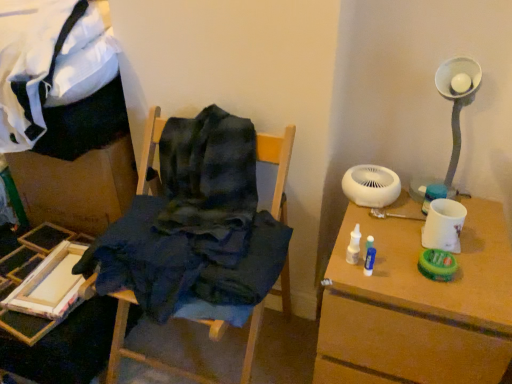
What do you see at coordinates (44, 291) in the screenshot?
I see `wooden paint tray at lower left, which ranks as the 2th furniture in right-to-left order` at bounding box center [44, 291].

Describe the element at coordinates (418, 306) in the screenshot. This screenshot has height=384, width=512. I see `white matte table at right` at that location.

The width and height of the screenshot is (512, 384). Describe the element at coordinates (134, 351) in the screenshot. I see `dark blue fabric at center, which is counted as the 2th furniture, starting from the left` at that location.

You are a GUI agent. You are given a task and a screenshot of the screen. Output one action in this format:
    pyautogui.click(x=<x>, y=<y>)
    Task: Click on the white matte mechanical fan at upper right
    The width and height of the screenshot is (512, 384).
    Given the screenshot: What is the action you would take?
    pyautogui.click(x=371, y=186)

Could you tell me if white matte mechanical fan at upper right is facing dark blue fabric at center, which is counted as the 2th furniture, starting from the left?

No, white matte mechanical fan at upper right is not aimed at dark blue fabric at center, which is counted as the 2th furniture, starting from the left.

Does point (373, 199) lie behind point (281, 147)?

Yes, point (373, 199) is farther from viewer.

Does white matte mechanical fan at upper right have a greater height compared to dark blue fabric at center, the 1th furniture when ordered from right to left?

No.

Is white matte table at right not within wooden paint tray at lower left, which ranks as the 2th furniture in right-to-left order?

Yes, white matte table at right is not within wooden paint tray at lower left, which ranks as the 2th furniture in right-to-left order.

From the image's perspective, is white matte table at right below wooden paint tray at lower left, which ranks as the 2th furniture in right-to-left order?

Yes, from the image's perspective, white matte table at right is below wooden paint tray at lower left, which ranks as the 2th furniture in right-to-left order.

Looking at their sizes, would you say white matte table at right is wider or thinner than wooden paint tray at lower left, the first furniture in the left-to-right sequence?

Clearly, white matte table at right has more width compared to wooden paint tray at lower left, the first furniture in the left-to-right sequence.

Is point (469, 369) closer to viewer compared to point (63, 315)?

Yes, it is.

Is dark blue fabric at center, which is counted as the 2th furniture, starting from the left, situated inside white matte mechanical fan at upper right or outside?

dark blue fabric at center, which is counted as the 2th furniture, starting from the left, lies outside white matte mechanical fan at upper right.

What's the angular difference between dark blue fabric at center, the 1th furniture when ordered from right to left, and white matte mechanical fan at upper right's facing directions?

They differ by 0.735 degrees in their facing directions.

Could you tell me if dark blue fabric at center, which is counted as the 2th furniture, starting from the left, is facing white matte mechanical fan at upper right?

No, dark blue fabric at center, which is counted as the 2th furniture, starting from the left, is not facing towards white matte mechanical fan at upper right.

Measure the distance between white matte mechanical fan at upper right and white matte table at right.

white matte mechanical fan at upper right and white matte table at right are 27.84 centimeters apart from each other.

Can you tell me how much white matte mechanical fan at upper right and white matte table at right differ in facing direction?

They differ by 1.29 degrees in their facing directions.

Is white matte mechanical fan at upper right looking in the opposite direction of white matte table at right?

No.

Can we say white matte mechanical fan at upper right lies outside white matte table at right?

Yes, white matte mechanical fan at upper right is located beyond the bounds of white matte table at right.

I want to click on furniture that appears behind the dark blue fabric at center, which is counted as the 2th furniture, starting from the left, so click(x=44, y=291).

Measure the distance from dark blue fabric at center, which is counted as the 2th furniture, starting from the left, to wooden paint tray at lower left, which ranks as the 2th furniture in right-to-left order.

dark blue fabric at center, which is counted as the 2th furniture, starting from the left, and wooden paint tray at lower left, which ranks as the 2th furniture in right-to-left order, are 12.56 inches apart from each other.

Considering the sizes of objects dark blue fabric at center, which is counted as the 2th furniture, starting from the left, and wooden paint tray at lower left, the first furniture in the left-to-right sequence, in the image provided, who is thinner, dark blue fabric at center, which is counted as the 2th furniture, starting from the left, or wooden paint tray at lower left, the first furniture in the left-to-right sequence,?

wooden paint tray at lower left, the first furniture in the left-to-right sequence, is thinner.

Is dark blue fabric at center, which is counted as the 2th furniture, starting from the left, looking in the opposite direction of wooden paint tray at lower left, which ranks as the 2th furniture in right-to-left order?

No, dark blue fabric at center, which is counted as the 2th furniture, starting from the left, is not facing the opposite direction of wooden paint tray at lower left, which ranks as the 2th furniture in right-to-left order.

From the image's perspective, who appears lower, wooden paint tray at lower left, the first furniture in the left-to-right sequence, or white matte table at right?

From the image's view, white matte table at right is below.

Is wooden paint tray at lower left, the first furniture in the left-to-right sequence, to the right of white matte table at right from the viewer's perspective?

Incorrect, wooden paint tray at lower left, the first furniture in the left-to-right sequence, is not on the right side of white matte table at right.

Is wooden paint tray at lower left, which ranks as the 2th furniture in right-to-left order, next to white matte table at right and touching it?

wooden paint tray at lower left, which ranks as the 2th furniture in right-to-left order, and white matte table at right are clearly separated.

Does wooden paint tray at lower left, the first furniture in the left-to-right sequence, contain white matte table at right?

No.

Considering the positions of point (25, 240) and point (366, 193), is point (25, 240) closer or farther from the camera than point (366, 193)?

Point (25, 240) appears to be farther away from the viewer than point (366, 193).

Consider the image. Between wooden paint tray at lower left, the first furniture in the left-to-right sequence, and white matte mechanical fan at upper right, which one has larger width?

Wider between the two is wooden paint tray at lower left, the first furniture in the left-to-right sequence.

Considering the sizes of wooden paint tray at lower left, which ranks as the 2th furniture in right-to-left order, and white matte mechanical fan at upper right in the image, is wooden paint tray at lower left, which ranks as the 2th furniture in right-to-left order, bigger or smaller than white matte mechanical fan at upper right?

Clearly, wooden paint tray at lower left, which ranks as the 2th furniture in right-to-left order, is larger in size than white matte mechanical fan at upper right.

Is wooden paint tray at lower left, which ranks as the 2th furniture in right-to-left order, located outside white matte mechanical fan at upper right?

Indeed, wooden paint tray at lower left, which ranks as the 2th furniture in right-to-left order, is completely outside white matte mechanical fan at upper right.

Starting from the white matte mechanical fan at upper right, which furniture is the 2nd one in front? Please provide its 2D coordinates.

[(134, 351)]

You are a GUI agent. You are given a task and a screenshot of the screen. Output one action in this format:
    pyautogui.click(x=<x>, y=<y>)
    Task: Click on the table below the wooden paint tray at lower left, which ranks as the 2th furniture in right-to-left order (from the image's perspective)
    This screenshot has height=384, width=512.
    Given the screenshot: What is the action you would take?
    pyautogui.click(x=418, y=306)

When comparing their distances from wooden paint tray at lower left, which ranks as the 2th furniture in right-to-left order, does dark blue fabric at center, which is counted as the 2th furniture, starting from the left, or white matte mechanical fan at upper right seem closer?

Based on the image, dark blue fabric at center, which is counted as the 2th furniture, starting from the left, appears to be nearer to wooden paint tray at lower left, which ranks as the 2th furniture in right-to-left order.

Consider the image. Which object lies further to the anchor point wooden paint tray at lower left, which ranks as the 2th furniture in right-to-left order, white matte table at right or white matte mechanical fan at upper right?

Based on the image, white matte mechanical fan at upper right appears to be further to wooden paint tray at lower left, which ranks as the 2th furniture in right-to-left order.

From the picture: When comparing their distances from wooden paint tray at lower left, which ranks as the 2th furniture in right-to-left order, does white matte mechanical fan at upper right or white matte table at right seem closer?

white matte table at right.

Looking at the image, which one is located closer to dark blue fabric at center, the 1th furniture when ordered from right to left, wooden paint tray at lower left, the first furniture in the left-to-right sequence, or white matte table at right?

Among the two, wooden paint tray at lower left, the first furniture in the left-to-right sequence, is located nearer to dark blue fabric at center, the 1th furniture when ordered from right to left.

When comparing their distances from white matte mechanical fan at upper right, does dark blue fabric at center, which is counted as the 2th furniture, starting from the left, or wooden paint tray at lower left, the first furniture in the left-to-right sequence, seem further?

Based on the image, wooden paint tray at lower left, the first furniture in the left-to-right sequence, appears to be further to white matte mechanical fan at upper right.

Estimate the real-world distances between objects in this image. Which object is closer to white matte mechanical fan at upper right, white matte table at right or wooden paint tray at lower left, which ranks as the 2th furniture in right-to-left order?

Based on the image, white matte table at right appears to be nearer to white matte mechanical fan at upper right.

Which object lies nearer to the anchor point dark blue fabric at center, which is counted as the 2th furniture, starting from the left, white matte mechanical fan at upper right or white matte table at right?

The object closer to dark blue fabric at center, which is counted as the 2th furniture, starting from the left, is white matte mechanical fan at upper right.

Based on their spatial positions, is wooden paint tray at lower left, the first furniture in the left-to-right sequence, or white matte table at right further from white matte mechanical fan at upper right?

wooden paint tray at lower left, the first furniture in the left-to-right sequence, lies further to white matte mechanical fan at upper right than the other object.

Locate an element on the screen. mechanical fan between wooden paint tray at lower left, which ranks as the 2th furniture in right-to-left order, and white matte table at right is located at coordinates (371, 186).

I want to click on mechanical fan between dark blue fabric at center, the 1th furniture when ordered from right to left, and white matte table at right, so click(x=371, y=186).

At what (x,y) coordinates should I click in order to perform the action: click on furniture located between wooden paint tray at lower left, the first furniture in the left-to-right sequence, and white matte mechanical fan at upper right in the left-right direction. Please return your answer as a coordinate pair (x, y). Looking at the image, I should click on (134, 351).

I want to click on furniture located between wooden paint tray at lower left, which ranks as the 2th furniture in right-to-left order, and white matte table at right in the left-right direction, so click(134, 351).